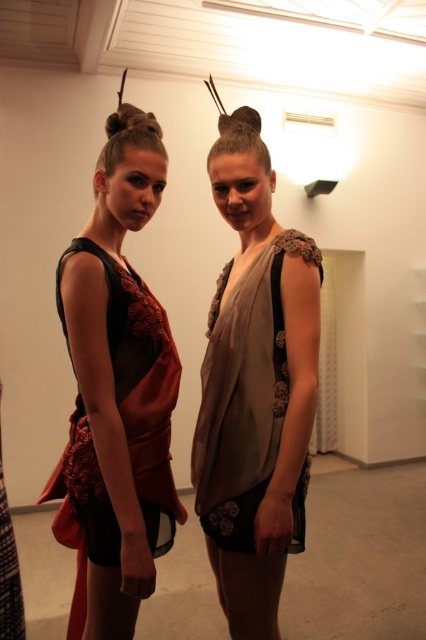
Question: From the image, what is the correct spatial relationship of matte red fabric dress at center in relation to matte beige dress at center?

Choices:
 (A) below
 (B) above

Answer: (B)

Question: Is matte red fabric dress at center bigger than matte beige dress at center?

Choices:
 (A) no
 (B) yes

Answer: (B)

Question: Can you confirm if matte red fabric dress at center is thinner than matte beige dress at center?

Choices:
 (A) no
 (B) yes

Answer: (A)